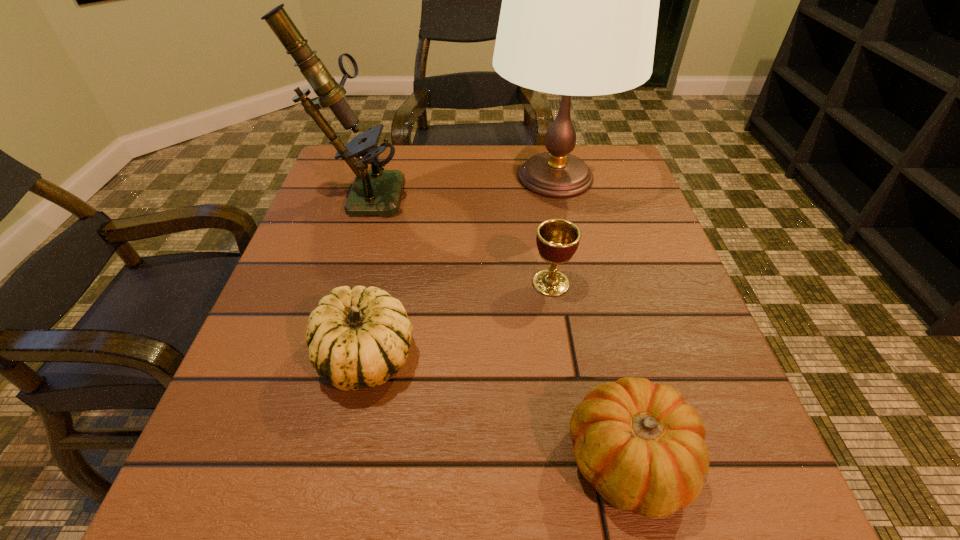
Find the location of a particular element. This screenshot has width=960, height=540. vacant position located on the left of the shorter gourd is located at coordinates (492, 460).

Identify the location of lamp positioned at the far edge. (580, 0).

At what (x,y) coordinates should I click in order to perform the action: click on microscope present at the far edge. Please return your answer as a coordinate pair (x, y). Image resolution: width=960 pixels, height=540 pixels. Looking at the image, I should click on (374, 192).

Find the location of a particular element. object that is at the near edge is located at coordinates (640, 444).

The width and height of the screenshot is (960, 540). In order to click on microscope that is positioned at the left edge in this screenshot , I will do `click(374, 192)`.

You are a GUI agent. You are given a task and a screenshot of the screen. Output one action in this format:
    pyautogui.click(x=<x>, y=<y>)
    Task: Click on the gourd that is at the left edge
    The width and height of the screenshot is (960, 540).
    Given the screenshot: What is the action you would take?
    pyautogui.click(x=358, y=337)

Image resolution: width=960 pixels, height=540 pixels. In order to click on lamp present at the right edge in this screenshot , I will do `click(580, 0)`.

You are a GUI agent. You are given a task and a screenshot of the screen. Output one action in this format:
    pyautogui.click(x=<x>, y=<y>)
    Task: Click on the gourd located in the right edge section of the desktop
    
    Given the screenshot: What is the action you would take?
    pyautogui.click(x=640, y=444)

Identify the location of object present at the far left corner. The width and height of the screenshot is (960, 540). (374, 192).

This screenshot has height=540, width=960. I want to click on object located at the far right corner, so click(x=580, y=0).